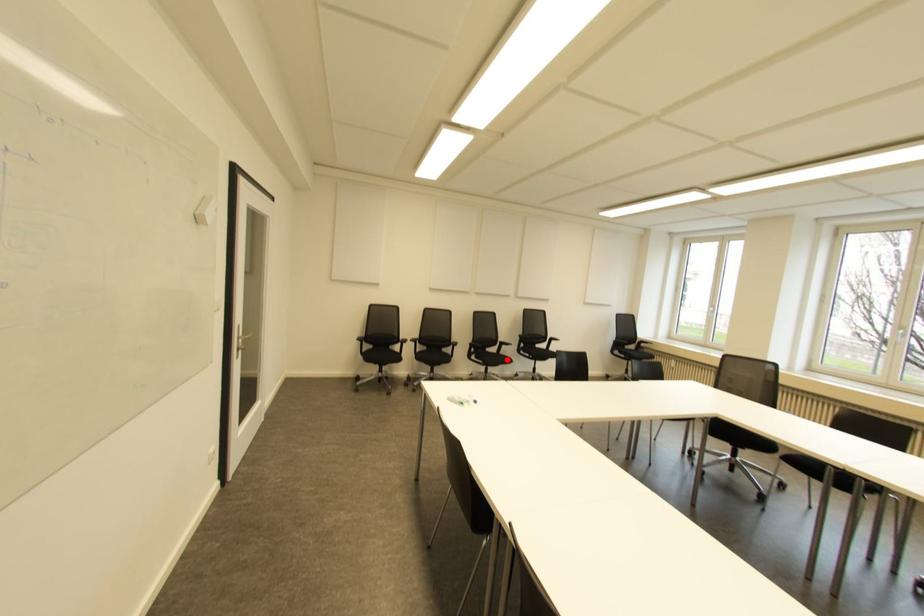
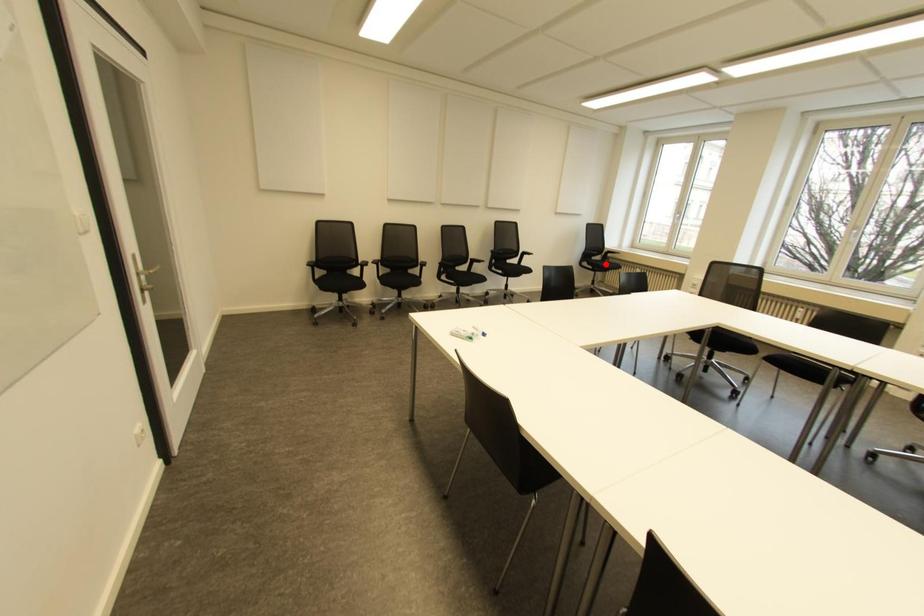
I am providing you with two images of the same scene from different viewpoints. A red point is marked on the first image and another point is marked on the second image. Is the marked point in image1 the same physical position as the marked point in image2?

No